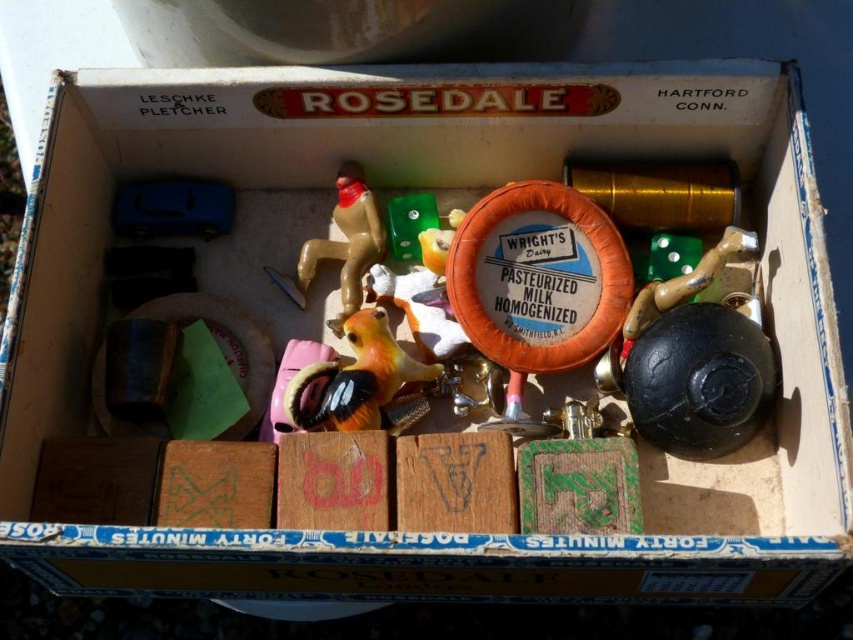
Question: Considering the relative positions of matte orange plastic toy at center and brown plastic monkey at center in the image provided, where is matte orange plastic toy at center located with respect to brown plastic monkey at center?

Choices:
 (A) right
 (B) left

Answer: (A)

Question: Among these objects, which one is nearest to the camera?

Choices:
 (A) matte orange plastic toy at center
 (B) brown plastic monkey at center

Answer: (A)

Question: Which point is closer to the camera taking this photo?

Choices:
 (A) (380, 356)
 (B) (351, 314)

Answer: (A)

Question: Can you confirm if matte orange plastic toy at center is positioned below brown plastic monkey at center?

Choices:
 (A) yes
 (B) no

Answer: (A)

Question: Can you confirm if matte orange plastic toy at center is positioned to the right of brown plastic monkey at center?

Choices:
 (A) no
 (B) yes

Answer: (B)

Question: Among these objects, which one is farthest from the camera?

Choices:
 (A) matte orange plastic toy at center
 (B) brown plastic monkey at center

Answer: (B)